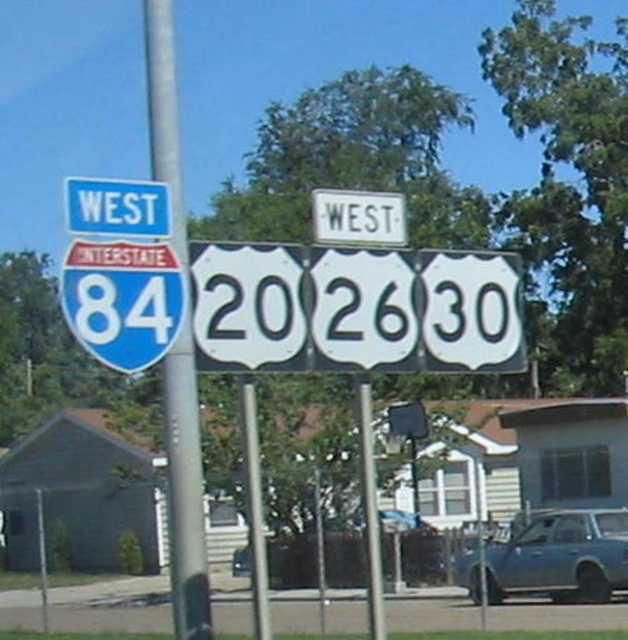
You are a driver approaching the roadside scene and need to locate the white plastic road sign at center. Based on the coordinates provided in the Objects Description, can you determine its exact position relative to the other highway signs mounted on the metal pole?

The white plastic road sign at center is located at coordinates point (x=354, y=308), which places it centrally among the other highway signs mounted on the metal pole.

Looking at this image, you are driving a car and see the white plastic road sign at center and the blue metallic sedan at center ahead on the road. Which object is closer to you?

The white plastic road sign at center is closer to the viewer than the blue metallic sedan at center.